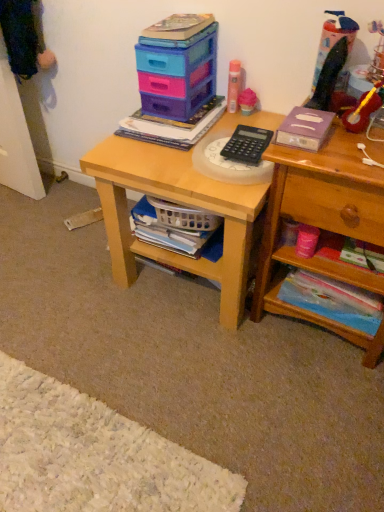
Where is `free space in front of rubberized plastic pencil sharpener at upper right, which is counted as the fourth toy, starting from the left`? Image resolution: width=384 pixels, height=512 pixels. free space in front of rubberized plastic pencil sharpener at upper right, which is counted as the fourth toy, starting from the left is located at coordinates (340, 149).